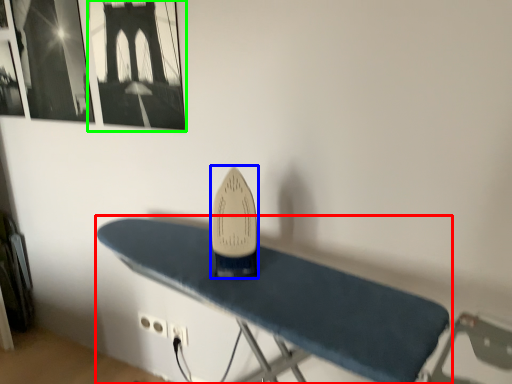
Question: Considering the real-world distances, which object is closest to furniture (highlighted by a red box)? surfboard (highlighted by a blue box) or picture frame (highlighted by a green box).

Choices:
 (A) surfboard
 (B) picture frame

Answer: (A)